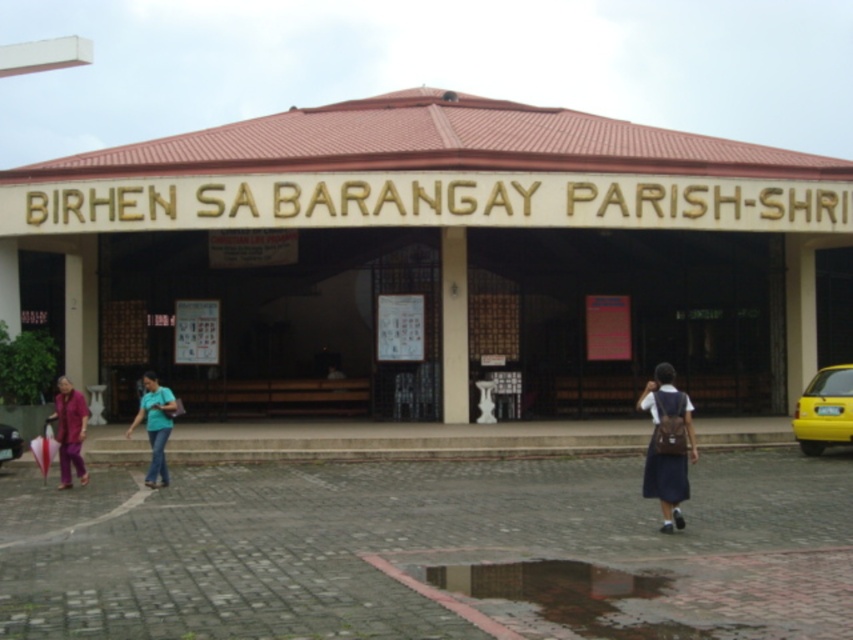
Question: Which of these objects is positioned closest to the brown wooden building at center?

Choices:
 (A) yellow matte car at lower right
 (B) teal fabric shirt at center
 (C) dark blue uniform at center
 (D) yellow matte taxi at right

Answer: (C)

Question: Is dark blue uniform at center closer to camera compared to matte purple pants at lower left?

Choices:
 (A) yes
 (B) no

Answer: (A)

Question: Can you confirm if yellow matte taxi at right is positioned below teal fabric shirt at center?

Choices:
 (A) yes
 (B) no

Answer: (B)

Question: Which object is positioned closest to the yellow matte taxi at right?

Choices:
 (A) brown wooden building at center
 (B) teal fabric shirt at center

Answer: (A)

Question: Is brown wooden building at center smaller than yellow matte car at lower right?

Choices:
 (A) no
 (B) yes

Answer: (A)

Question: Which object is the farthest from the matte purple pants at lower left?

Choices:
 (A) brown wooden building at center
 (B) yellow matte taxi at right
 (C) yellow matte car at lower right
 (D) dark blue uniform at center

Answer: (A)